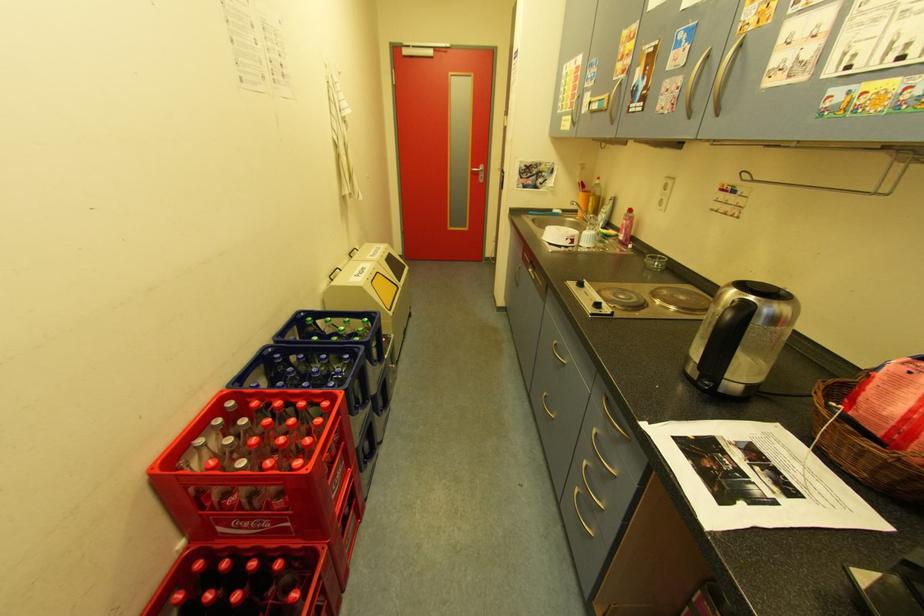
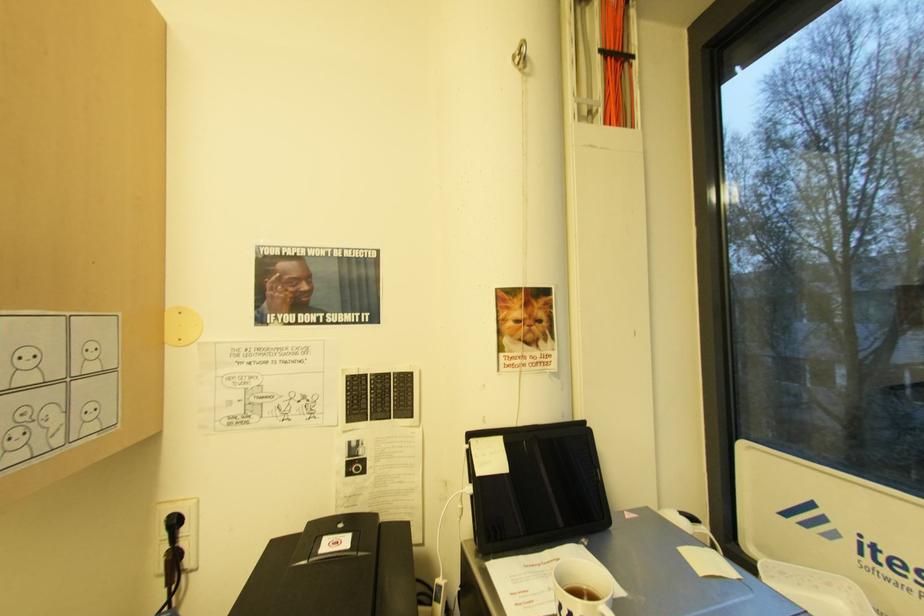
Question: The camera is either moving clockwise (left) or counter-clockwise (right) around the object. The first image is from the beginning of the video and the second image is from the end. Is the camera moving left or right when shooting the video?

Choices:
 (A) Left
 (B) Right

Answer: (A)